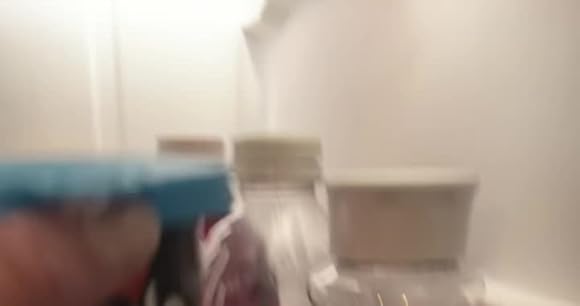
At what (x,y) coordinates should I click in order to perform the action: click on white wall right of bottles. Please return your answer as a coordinate pair (x, y). This screenshot has height=306, width=580. Looking at the image, I should click on (477, 92).